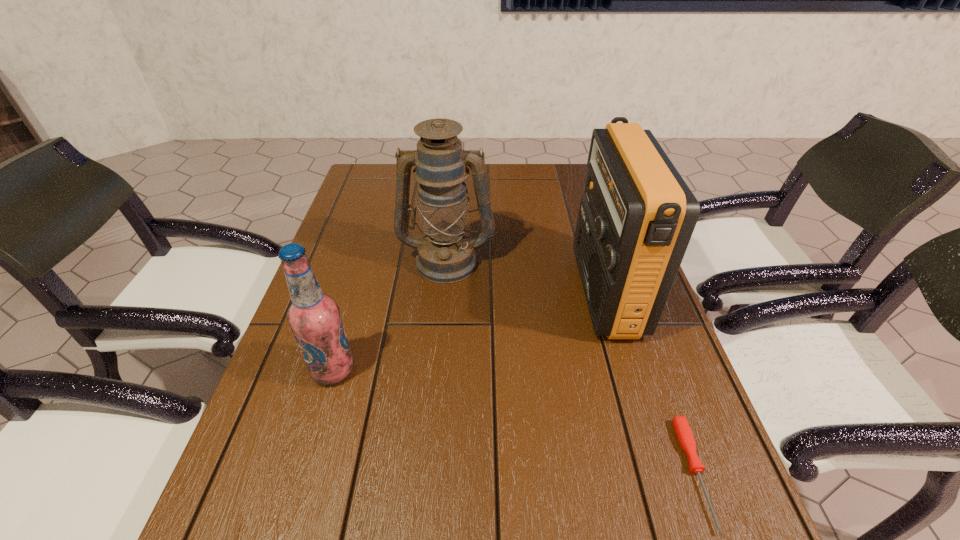
Locate an element on the screen. The image size is (960, 540). oil lamp is located at coordinates (446, 254).

Identify the location of radio receiver. coord(636,218).

I want to click on alcohol, so click(x=314, y=318).

The height and width of the screenshot is (540, 960). In order to click on the second shortest object in this screenshot , I will do `click(314, 318)`.

Where is `the nearest object`? Image resolution: width=960 pixels, height=540 pixels. the nearest object is located at coordinates (682, 429).

I want to click on the shortest object, so click(x=682, y=429).

The image size is (960, 540). Identify the location of free space located 0.300m on the right of the third object from right to left. (606, 260).

Image resolution: width=960 pixels, height=540 pixels. In order to click on blank area located 0.130m on the front-facing side of the radio receiver in this screenshot , I will do `click(527, 292)`.

Where is `free region located 0.220m on the front-facing side of the radio receiver`? The image size is (960, 540). free region located 0.220m on the front-facing side of the radio receiver is located at coordinates (492, 292).

Locate an element on the screen. vacant region located on the front-facing side of the radio receiver is located at coordinates (547, 292).